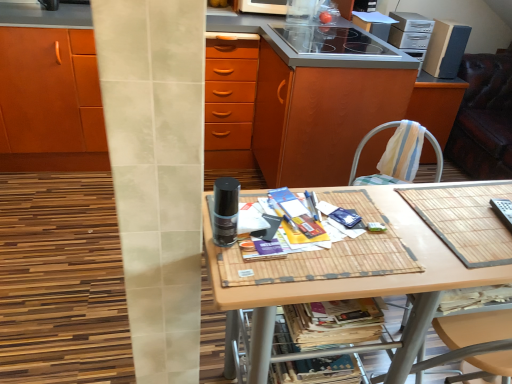
Where is `free space in front of matte paper magazine at center, arranged as the 1th magazine when viewed from the top`? This screenshot has width=512, height=384. free space in front of matte paper magazine at center, arranged as the 1th magazine when viewed from the top is located at coordinates (279, 276).